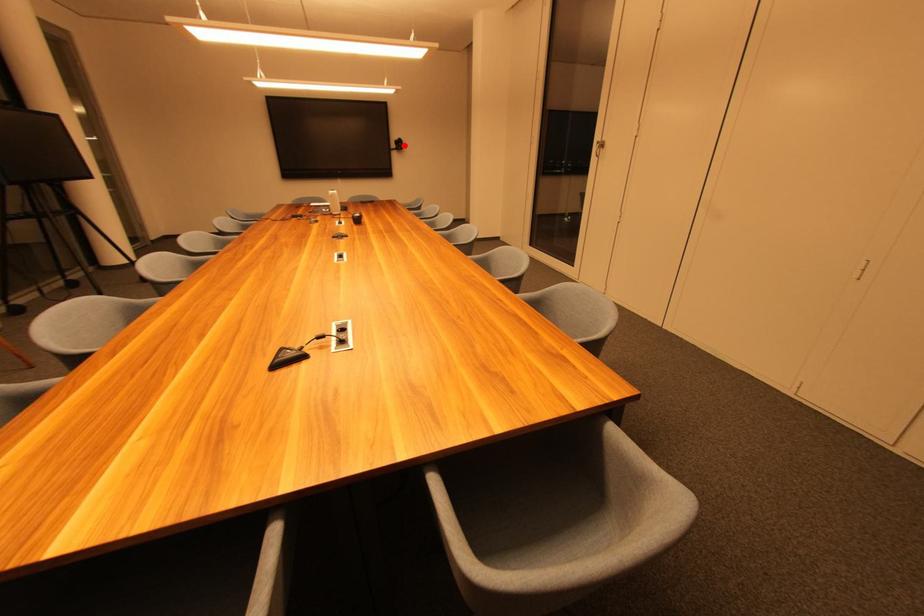
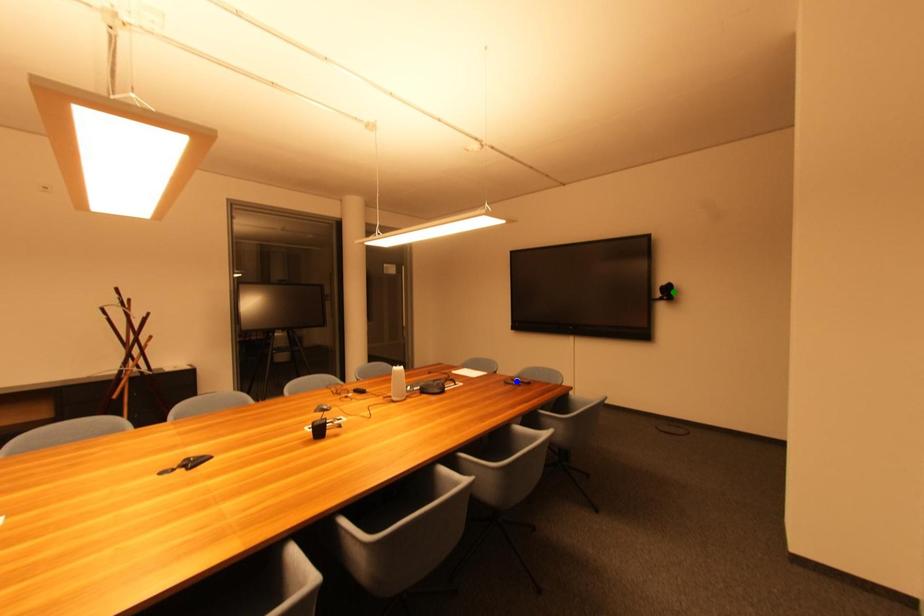
Question: I am providing you with two images of the same scene from different viewpoints. A red point is marked on the first image. You are given multiple points on the second image. Can you choose the point in image 2 that corresponds to the point in image 1?

Choices:
 (A) green point
 (B) yellow point
 (C) blue point

Answer: (A)